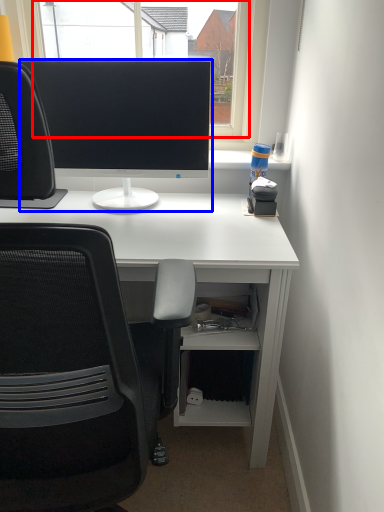
Question: Among these objects, which one is farthest to the camera, window screen (highlighted by a red box) or computer monitor (highlighted by a blue box)?

Choices:
 (A) window screen
 (B) computer monitor

Answer: (A)